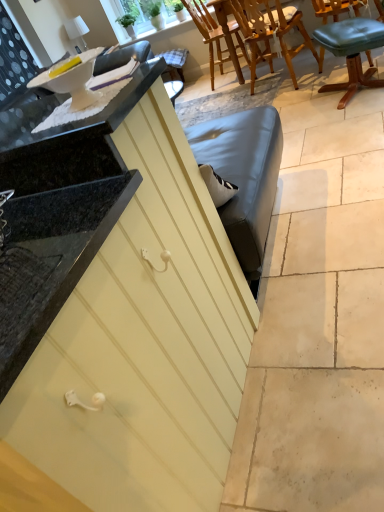
What is the approximate width of wooden chair at upper center, marked as the second chair in a back-to-front arrangement?

wooden chair at upper center, marked as the second chair in a back-to-front arrangement, is 24.85 inches wide.

Image resolution: width=384 pixels, height=512 pixels. Find the location of `wooden chair at upper center, which appears as the second chair when viewed from the front`. wooden chair at upper center, which appears as the second chair when viewed from the front is located at coordinates (269, 33).

Image resolution: width=384 pixels, height=512 pixels. Describe the element at coordinates (351, 52) in the screenshot. I see `green leather stool at upper right, the third chair from the back` at that location.

In the scene shown: In order to face matte yellow cabinet at center, should I rotate leftwards or rightwards?

You should rotate left by 26.693 degrees.

This screenshot has width=384, height=512. What are the coordinates of `matte yellow cabinet at center` in the screenshot? It's located at (120, 308).

The height and width of the screenshot is (512, 384). Describe the element at coordinates (208, 33) in the screenshot. I see `wooden chair at upper center, which is the third chair in front-to-back order` at that location.

At what (x,y) coordinates should I click in order to perform the action: click on wooden chair at upper center, marked as the second chair in a back-to-front arrangement. Please return your answer as a coordinate pair (x, y). Looking at the image, I should click on (269, 33).

Does green leather stool at upper right, the third chair from the back, touch matte yellow cabinet at center?

green leather stool at upper right, the third chair from the back, and matte yellow cabinet at center are clearly separated.

Considering the sizes of objects green leather stool at upper right, which is counted as the first chair, starting from the front, and matte yellow cabinet at center in the image provided, who is bigger, green leather stool at upper right, which is counted as the first chair, starting from the front, or matte yellow cabinet at center?

matte yellow cabinet at center.

At what (x,y) coordinates should I click in order to perform the action: click on the 1st chair behind the matte yellow cabinet at center, counting from the anchor's position. Please return your answer as a coordinate pair (x, y). The height and width of the screenshot is (512, 384). Looking at the image, I should click on (351, 52).

From a real-world perspective, which is physically above, green leather stool at upper right, which is counted as the first chair, starting from the front, or matte yellow cabinet at center?

In real-world perspective, matte yellow cabinet at center is above.

Considering the positions of objects white glossy countertop at upper left and green leather stool at upper right, the third chair from the back, in the image provided, who is in front, white glossy countertop at upper left or green leather stool at upper right, the third chair from the back,?

Positioned in front is white glossy countertop at upper left.

What's the angular difference between white glossy countertop at upper left and green leather stool at upper right, the third chair from the back,'s facing directions?

70 degrees separate the facing orientations of white glossy countertop at upper left and green leather stool at upper right, the third chair from the back.

I want to click on chair that is the 3rd one when counting rightward from the white glossy countertop at upper left, so click(351, 52).

Which is correct: white glossy countertop at upper left is inside wooden chair at upper center, marked as the second chair in a back-to-front arrangement, or outside of it?

white glossy countertop at upper left exists outside the volume of wooden chair at upper center, marked as the second chair in a back-to-front arrangement.

How different are the orientations of white glossy countertop at upper left and wooden chair at upper center, which appears as the second chair when viewed from the front, in degrees?

There is a 160-degree angle between the facing directions of white glossy countertop at upper left and wooden chair at upper center, which appears as the second chair when viewed from the front.

From the picture: Between white glossy countertop at upper left and wooden chair at upper center, which appears as the second chair when viewed from the front, which one appears on the left side from the viewer's perspective?

Positioned to the left is white glossy countertop at upper left.

From a real-world perspective, is wooden chair at upper center, which is the third chair in front-to-back order, below green leather stool at upper right, the third chair from the back?

No, from a real-world perspective, wooden chair at upper center, which is the third chair in front-to-back order, is not under green leather stool at upper right, the third chair from the back.

Does point (210, 46) come in front of point (336, 49)?

No.

Which of these two, wooden chair at upper center, arranged as the first chair when viewed from the back, or green leather stool at upper right, the third chair from the back, stands shorter?

green leather stool at upper right, the third chair from the back.

Could you tell me if matte yellow cabinet at center is turned towards wooden chair at upper center, marked as the second chair in a back-to-front arrangement?

No, matte yellow cabinet at center does not turn towards wooden chair at upper center, marked as the second chair in a back-to-front arrangement.

Which object is thinner, matte yellow cabinet at center or wooden chair at upper center, marked as the second chair in a back-to-front arrangement?

With smaller width is wooden chair at upper center, marked as the second chair in a back-to-front arrangement.

Is matte yellow cabinet at center inside the boundaries of wooden chair at upper center, which appears as the second chair when viewed from the front, or outside?

matte yellow cabinet at center is spatially situated outside wooden chair at upper center, which appears as the second chair when viewed from the front.

Which is more to the left, matte yellow cabinet at center or wooden chair at upper center, marked as the second chair in a back-to-front arrangement?

Positioned to the left is matte yellow cabinet at center.

Between white glossy countertop at upper left and matte yellow cabinet at center, which one is positioned behind?

white glossy countertop at upper left.

Is white glossy countertop at upper left far from matte yellow cabinet at center?

No, there isn't a large distance between white glossy countertop at upper left and matte yellow cabinet at center.

Is wooden chair at upper center, which appears as the second chair when viewed from the front, directly adjacent to wooden chair at upper center, arranged as the first chair when viewed from the back?

There is a gap between wooden chair at upper center, which appears as the second chair when viewed from the front, and wooden chair at upper center, arranged as the first chair when viewed from the back.

Is wooden chair at upper center, marked as the second chair in a back-to-front arrangement, at the left side of wooden chair at upper center, which is the third chair in front-to-back order?

In fact, wooden chair at upper center, marked as the second chair in a back-to-front arrangement, is to the right of wooden chair at upper center, which is the third chair in front-to-back order.

Looking at this image, from a real-world perspective, which object rests below the other?

wooden chair at upper center, which appears as the second chair when viewed from the front.

How different are the orientations of wooden chair at upper center, which appears as the second chair when viewed from the front, and wooden chair at upper center, which is the third chair in front-to-back order, in degrees?

The angle between the facing direction of wooden chair at upper center, which appears as the second chair when viewed from the front, and the facing direction of wooden chair at upper center, which is the third chair in front-to-back order, is 74.1 degrees.

Where is `chair that is the 3rd one below the matte yellow cabinet at center (from a real-world perspective)`? chair that is the 3rd one below the matte yellow cabinet at center (from a real-world perspective) is located at coordinates pyautogui.click(x=351, y=52).

You are a GUI agent. You are given a task and a screenshot of the screen. Output one action in this format:
    pyautogui.click(x=<x>, y=<y>)
    Task: Click on the countertop on the left of green leather stool at upper right, which is counted as the first chair, starting from the front
    
    Given the screenshot: What is the action you would take?
    pyautogui.click(x=75, y=113)

When comparing their distances from green leather stool at upper right, which is counted as the first chair, starting from the front, does white glossy countertop at upper left or matte yellow cabinet at center seem closer?

white glossy countertop at upper left.

Looking at the image, which one is located closer to white glossy countertop at upper left, wooden chair at upper center, which is the third chair in front-to-back order, or green leather stool at upper right, which is counted as the first chair, starting from the front?

green leather stool at upper right, which is counted as the first chair, starting from the front, is closer to white glossy countertop at upper left.

Considering their positions, is matte yellow cabinet at center positioned further to wooden chair at upper center, marked as the second chair in a back-to-front arrangement, than green leather stool at upper right, which is counted as the first chair, starting from the front?

matte yellow cabinet at center is positioned further to the anchor wooden chair at upper center, marked as the second chair in a back-to-front arrangement.

Considering their positions, is wooden chair at upper center, marked as the second chair in a back-to-front arrangement, positioned further to wooden chair at upper center, arranged as the first chair when viewed from the back, than white glossy countertop at upper left?

Based on the image, white glossy countertop at upper left appears to be further to wooden chair at upper center, arranged as the first chair when viewed from the back.

Considering their positions, is wooden chair at upper center, which is the third chair in front-to-back order, positioned closer to green leather stool at upper right, which is counted as the first chair, starting from the front, than wooden chair at upper center, marked as the second chair in a back-to-front arrangement?

wooden chair at upper center, marked as the second chair in a back-to-front arrangement, is closer to green leather stool at upper right, which is counted as the first chair, starting from the front.

Considering their positions, is matte yellow cabinet at center positioned further to green leather stool at upper right, which is counted as the first chair, starting from the front, than wooden chair at upper center, marked as the second chair in a back-to-front arrangement?

matte yellow cabinet at center.

Estimate the real-world distances between objects in this image. Which object is further from matte yellow cabinet at center, wooden chair at upper center, marked as the second chair in a back-to-front arrangement, or white glossy countertop at upper left?

Among the two, wooden chair at upper center, marked as the second chair in a back-to-front arrangement, is located further to matte yellow cabinet at center.

Based on their spatial positions, is wooden chair at upper center, which appears as the second chair when viewed from the front, or wooden chair at upper center, arranged as the first chair when viewed from the back, further from matte yellow cabinet at center?

Among the two, wooden chair at upper center, arranged as the first chair when viewed from the back, is located further to matte yellow cabinet at center.

Identify the location of chair between matte yellow cabinet at center and wooden chair at upper center, marked as the second chair in a back-to-front arrangement, from front to back. The height and width of the screenshot is (512, 384). (351, 52).

This screenshot has width=384, height=512. In order to click on chair located between white glossy countertop at upper left and wooden chair at upper center, which appears as the second chair when viewed from the front, in the depth direction in this screenshot , I will do pos(351,52).

Image resolution: width=384 pixels, height=512 pixels. In order to click on countertop positioned between matte yellow cabinet at center and wooden chair at upper center, which is the third chair in front-to-back order, from near to far in this screenshot , I will do click(75, 113).

Locate an element on the screen. countertop between matte yellow cabinet at center and wooden chair at upper center, which appears as the second chair when viewed from the front, in the front-back direction is located at coordinates (75, 113).